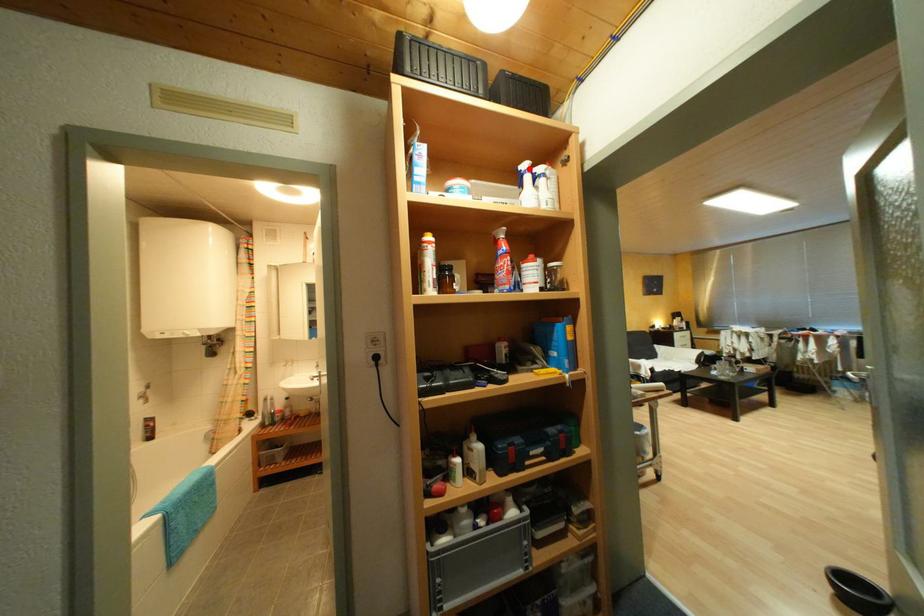
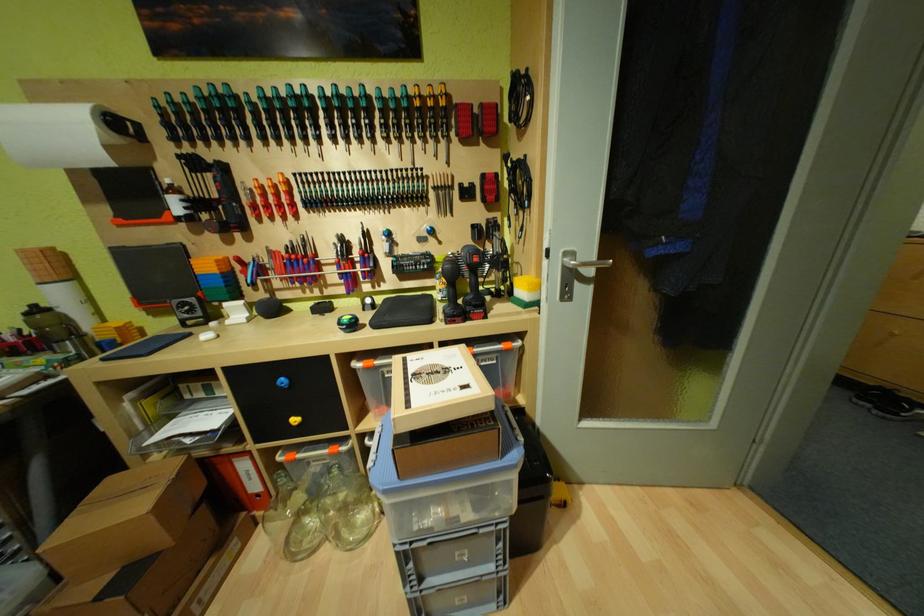
Question: I am providing you with two images of the same scene from different viewpoints. A red point is marked on the first image. Can you still see the location of the red point in image 2?

Choices:
 (A) Yes
 (B) No

Answer: (B)